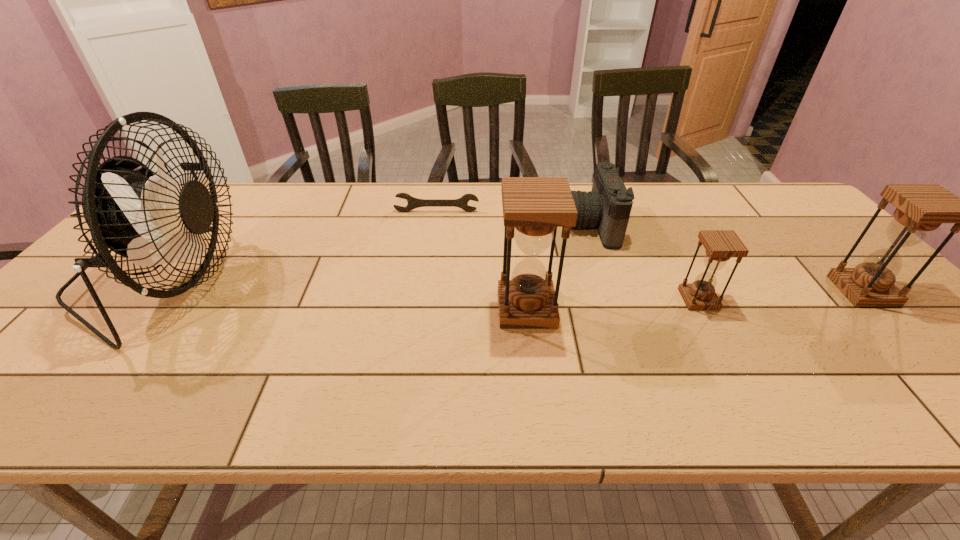
Locate which object ranks in proximity to the leftmost hourglass. Please provide its 2D coordinates. Your answer should be formatted as a tuple, i.e. [(x, y)], where the tuple contains the x and y coordinates of a point satisfying the conditions above.

[(608, 205)]

Locate which hourglass is the closest to the leftmost hourglass. Please provide its 2D coordinates. Your answer should be formatted as a tuple, i.e. [(x, y)], where the tuple contains the x and y coordinates of a point satisfying the conditions above.

[(721, 245)]

Where is `hourglass that is the closest to the shortest hourglass`? Image resolution: width=960 pixels, height=540 pixels. hourglass that is the closest to the shortest hourglass is located at coordinates (533, 207).

Identify the location of blank area in the image that satisfies the following two spatial constraints: 1. in front of the second shortest hourglass, directing airflow; 2. on the left side of the fan. (156, 291).

Find the location of a particular element. free space in the image that satisfies the following two spatial constraints: 1. on the back side of the third object from left to right; 2. in front of the fan, directing airflow is located at coordinates (524, 281).

Locate an element on the screen. The image size is (960, 540). vacant area that satisfies the following two spatial constraints: 1. at the lens of the camera; 2. on the right side of the second hourglass from right to left is located at coordinates (617, 299).

At what (x,y) coordinates should I click in order to perform the action: click on free space that satisfies the following two spatial constraints: 1. at the lens of the fifth object from left to right; 2. on the right side of the third object from right to left. Please return your answer as a coordinate pair (x, y). Looking at the image, I should click on (617, 299).

The width and height of the screenshot is (960, 540). What are the coordinates of `free space in the image that satisfies the following two spatial constraints: 1. in front of the leftmost object, directing airflow; 2. on the right side of the fifth object from left to right` in the screenshot? It's located at (149, 299).

In order to click on free location that satisfies the following two spatial constraints: 1. at the lens of the third object from right to left; 2. on the right side of the second object from right to left in this screenshot , I will do [x=617, y=299].